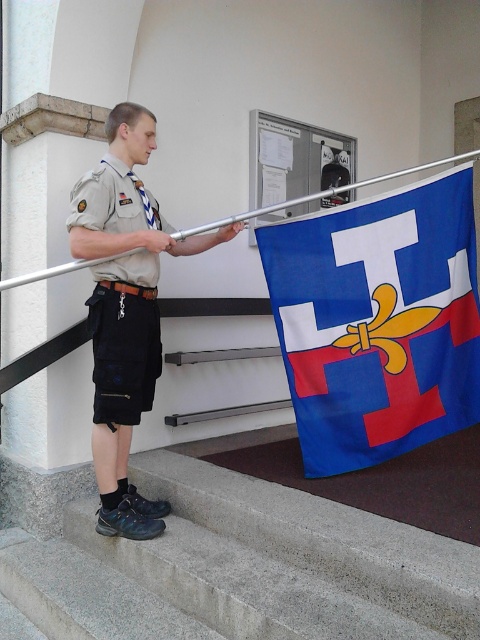
Consider the image. You are a photographer standing at the bottom of the concrete stairs at lower left. You want to take a photo of the khaki uniform at center. Since the stairs are in the way, can you move around them to get a clear shot? Explain why or why not based on their sizes.

The concrete stairs at lower left has a larger size compared to khaki uniform at center, so moving around them might be possible since the stairs are bigger and could provide space to maneuver around for a clear shot.

You are a visitor trying to find the entrance to the building. You see the concrete stairs at lower left and the khaki uniform at center. Which object is wider?

The concrete stairs at lower left is wider than the khaki uniform at center.